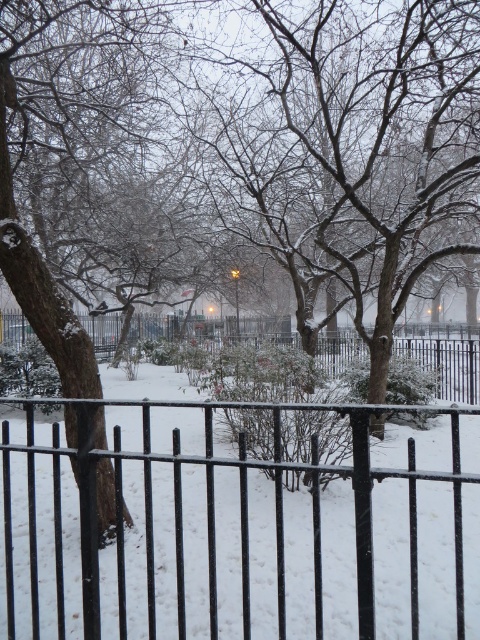
Question: Which object is closer to the camera taking this photo?

Choices:
 (A) black metal fence at center
 (B) snow-covered branches at center

Answer: (A)

Question: Is snow-covered branches at center to the left of black metal fence at center from the viewer's perspective?

Choices:
 (A) yes
 (B) no

Answer: (B)

Question: Which object appears farthest from the camera in this image?

Choices:
 (A) black metal fence at center
 (B) snow-covered branches at center

Answer: (B)

Question: Can you confirm if snow-covered branches at center is positioned above black metal fence at center?

Choices:
 (A) yes
 (B) no

Answer: (A)

Question: Does snow-covered branches at center have a greater width compared to black metal fence at center?

Choices:
 (A) no
 (B) yes

Answer: (B)